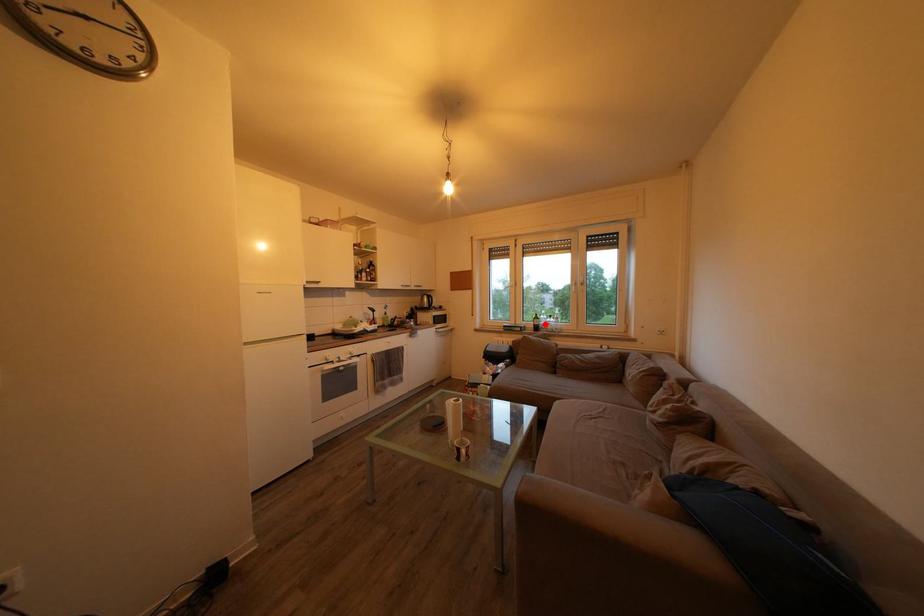
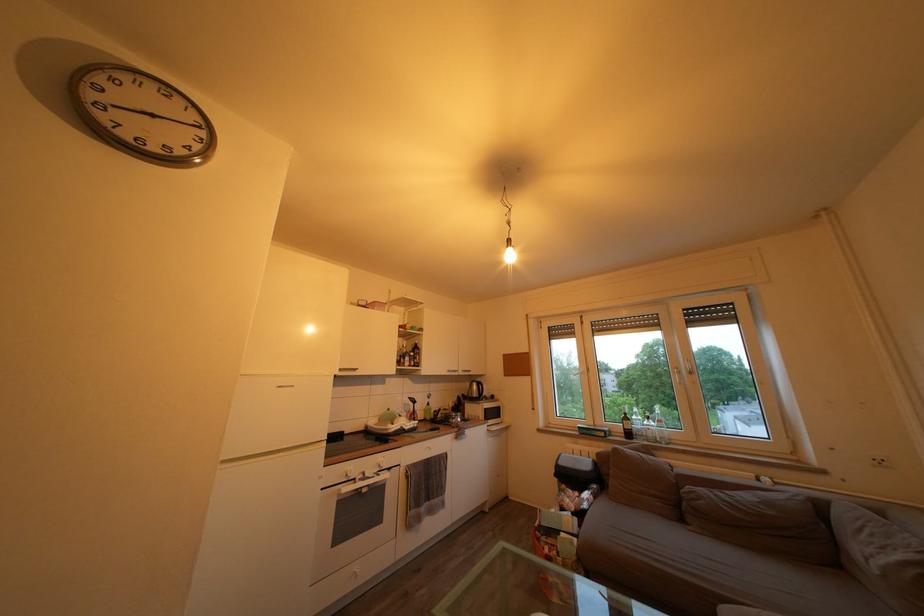
Question: A red point is marked in image1. In image2, is the corresponding 3D point closer to the camera or farther? Reply with the corresponding letter.

Choices:
 (A) The corresponding 3D point is closer.
 (B) The corresponding 3D point is farther.

Answer: (B)